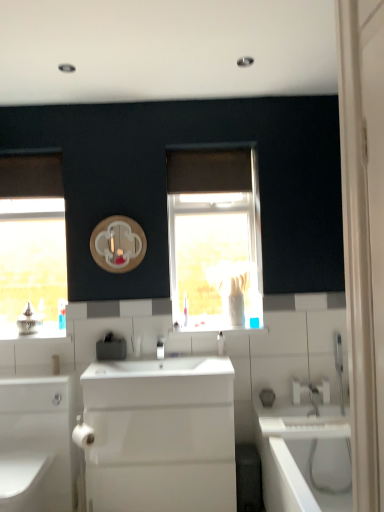
Question: Considering the positions of point (160, 340) and point (119, 342), is point (160, 340) closer or farther from the camera than point (119, 342)?

Choices:
 (A) farther
 (B) closer

Answer: (A)

Question: Relative to satin black soap dispenser at center, is white glossy tap at center in front or behind?

Choices:
 (A) front
 (B) behind

Answer: (A)

Question: Considering the real-world distances, which object is closest to the white glossy tap at center?

Choices:
 (A) satin black soap dispenser at center
 (B) white glossy bathtub at lower right
 (C) wooden circle at center
 (D) white glossy sink at center
 (E) white glossy cabinet at lower left

Answer: (A)

Question: Estimate the real-world distances between objects in this image. Which object is farther from the satin black soap dispenser at center?

Choices:
 (A) white glossy sink at center
 (B) white glossy cabinet at lower left
 (C) white glossy tap at center
 (D) wooden circle at center
 (E) white glossy soap dispenser at center

Answer: (E)